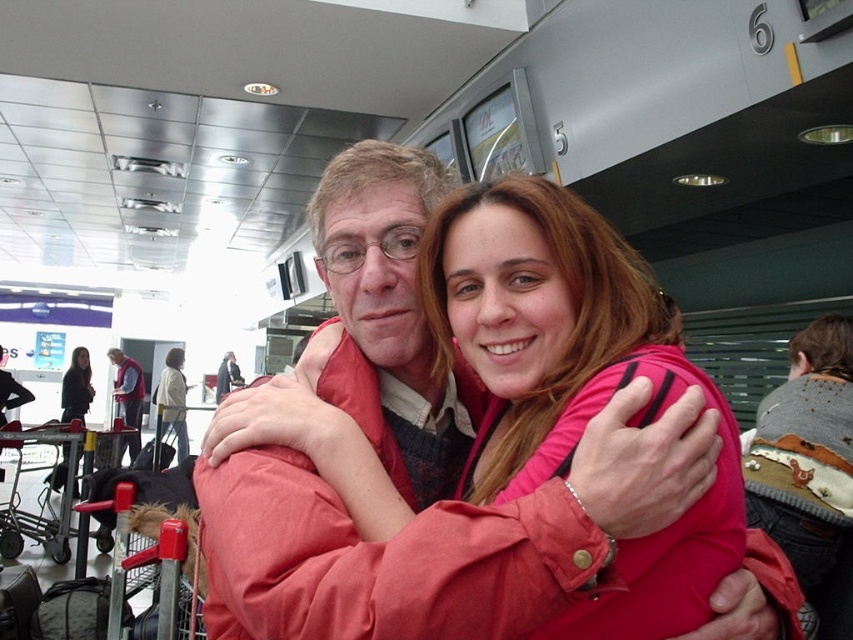
Between pink fabric at center and black leather jacket at left, which one is positioned higher?

pink fabric at center is higher up.

This screenshot has height=640, width=853. I want to click on pink fabric at center, so click(573, 381).

What are the coordinates of `pink fabric at center` in the screenshot? It's located at (573, 381).

Which of these two, matte gray vest at center or black leather jacket at left, stands taller?

With more height is matte gray vest at center.

Between point (115, 397) and point (84, 403), which one is positioned behind?

The point (115, 397) is behind.

Is point (135, 384) positioned in front of point (64, 442)?

No.

I want to click on matte gray vest at center, so click(128, 397).

Who is taller, light beige sweater at center or matte gray vest at center?

light beige sweater at center

Between point (183, 440) and point (132, 456), which one is positioned behind?

The point (183, 440) is behind.

Where is `light beige sweater at center`? This screenshot has height=640, width=853. light beige sweater at center is located at coordinates (173, 401).